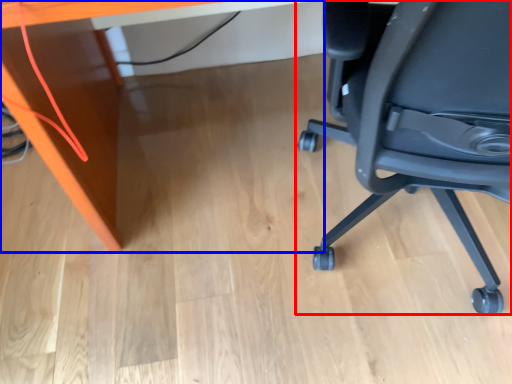
Question: Which object appears farthest to the camera in this image, chair (highlighted by a red box) or desk (highlighted by a blue box)?

Choices:
 (A) chair
 (B) desk

Answer: (B)